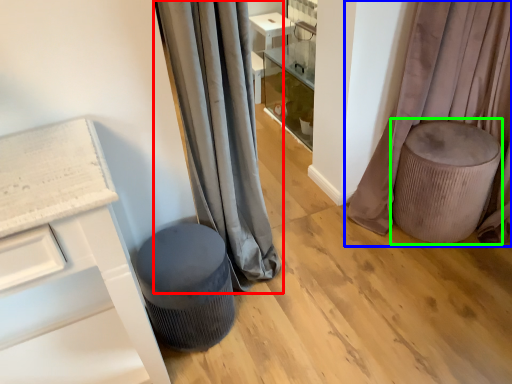
Question: Which is farther away from curtain (highlighted by a red box)? curtain (highlighted by a blue box) or swivel chair (highlighted by a green box)?

Choices:
 (A) curtain
 (B) swivel chair

Answer: (A)